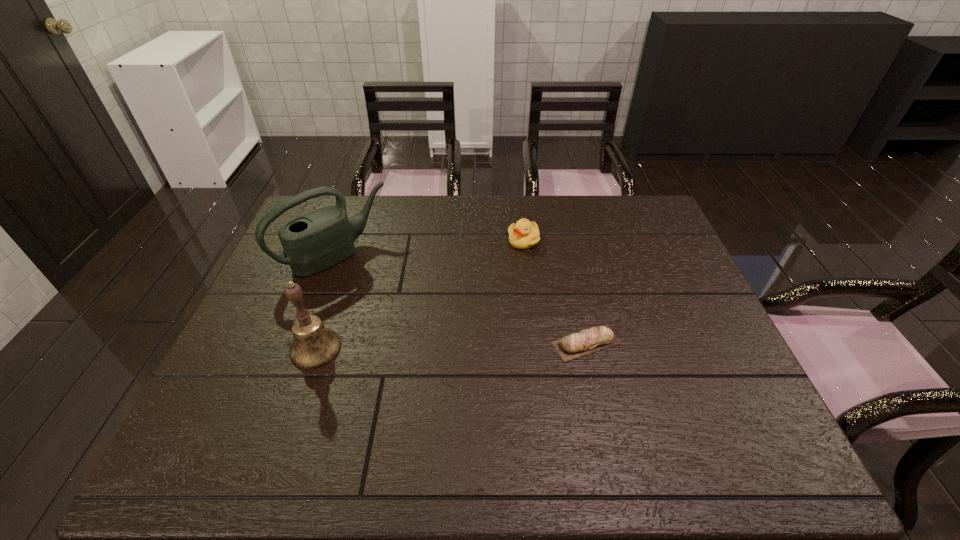
Where is `free space at the right edge`? This screenshot has width=960, height=540. free space at the right edge is located at coordinates (638, 238).

Where is `blank space at the far left corner`? The width and height of the screenshot is (960, 540). blank space at the far left corner is located at coordinates (351, 205).

You are a GUI agent. You are given a task and a screenshot of the screen. Output one action in this format:
    pyautogui.click(x=<x>, y=<y>)
    Task: Click on the blank space at the far right corner of the desktop
    The width and height of the screenshot is (960, 540).
    Given the screenshot: What is the action you would take?
    pyautogui.click(x=646, y=220)

Locate an element on the screen. vacant space in between the bell and the third tallest object is located at coordinates (420, 294).

You are a GUI agent. You are given a task and a screenshot of the screen. Output one action in this format:
    pyautogui.click(x=<x>, y=<y>)
    Task: Click on the empty location between the duckling and the watering can
    This screenshot has width=960, height=540.
    Given the screenshot: What is the action you would take?
    pyautogui.click(x=430, y=248)

This screenshot has width=960, height=540. What are the coordinates of `free space between the bell and the pita bread` in the screenshot? It's located at (451, 346).

At what (x,y) coordinates should I click in order to perform the action: click on vacant region between the second shortest object and the pita bread. Please return your answer as a coordinate pair (x, y). This screenshot has width=960, height=540. Looking at the image, I should click on pyautogui.click(x=555, y=292).

Identify the location of free spot between the bell and the pita bread. This screenshot has height=540, width=960. 451,346.

Where is `free spot between the watering can and the bell`? This screenshot has height=540, width=960. free spot between the watering can and the bell is located at coordinates (325, 301).

Image resolution: width=960 pixels, height=540 pixels. Identify the location of vacant space that's between the pita bread and the third tallest object. (555, 292).